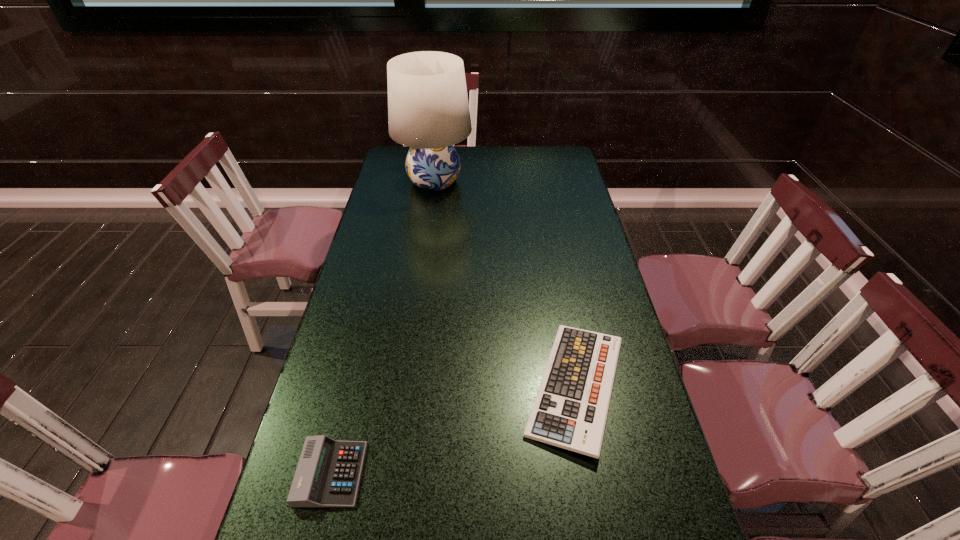
This screenshot has height=540, width=960. I want to click on calculator positioned at the left edge, so click(328, 473).

At what (x,y) coordinates should I click in order to perform the action: click on object located at the right edge. Please return your answer as a coordinate pair (x, y). Looking at the image, I should click on (570, 410).

The height and width of the screenshot is (540, 960). Find the location of `object situated at the far left corner`. object situated at the far left corner is located at coordinates (428, 110).

This screenshot has height=540, width=960. Find the location of `vacant space at the far edge`. vacant space at the far edge is located at coordinates (527, 172).

The image size is (960, 540). What are the coordinates of `free space at the left edge of the desktop` in the screenshot? It's located at (402, 222).

The height and width of the screenshot is (540, 960). Find the location of `free location at the right edge of the desktop`. free location at the right edge of the desktop is located at coordinates (601, 247).

In the image, there is a desktop. Where is `free space at the far left corner`? The image size is (960, 540). free space at the far left corner is located at coordinates (402, 152).

The width and height of the screenshot is (960, 540). What are the coordinates of `vacant area that lies between the lampshade and the shortest object` in the screenshot? It's located at 505,284.

In order to click on vacant space that's between the farthest object and the calculator in this screenshot , I will do (383, 327).

Identify which object is the second closest to the shortest object. Please provide its 2D coordinates. Your answer should be formatted as a tuple, i.e. [(x, y)], where the tuple contains the x and y coordinates of a point satisfying the conditions above.

[(428, 110)]